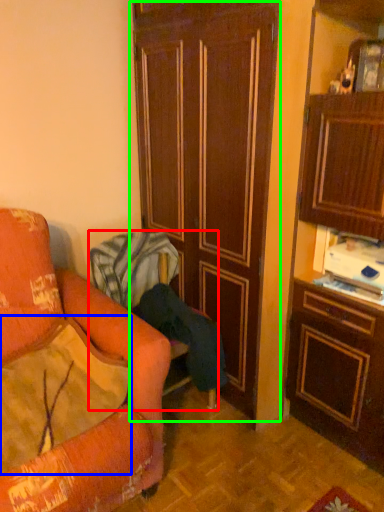
Question: Estimate the real-world distances between objects in this image. Which object is closer to chair (highlighted by a red box), pillow (highlighted by a blue box) or door (highlighted by a green box)?

Choices:
 (A) pillow
 (B) door

Answer: (B)